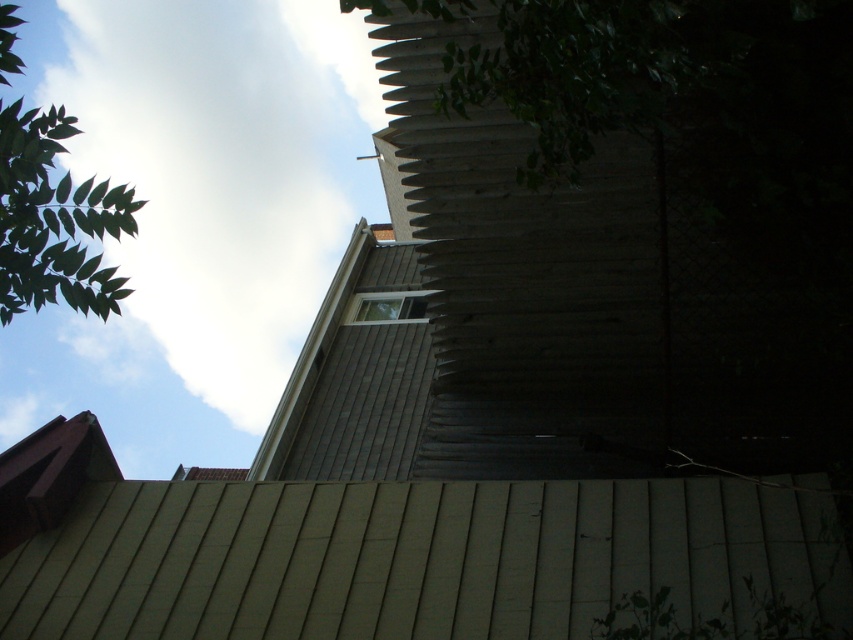
Question: Does green leafy tree at upper left have a greater width compared to clear glass window at upper center?

Choices:
 (A) yes
 (B) no

Answer: (A)

Question: Which object is farther from the camera taking this photo?

Choices:
 (A) green leafy tree at upper left
 (B) clear glass window at upper center

Answer: (B)

Question: Does green leafy tree at upper left appear on the right side of clear glass window at upper center?

Choices:
 (A) no
 (B) yes

Answer: (A)

Question: Which of the following is the farthest from the observer?

Choices:
 (A) green leafy tree at upper left
 (B) clear glass window at upper center

Answer: (B)

Question: Which of the following is the closest to the observer?

Choices:
 (A) (368, 296)
 (B) (74, 298)

Answer: (B)

Question: Can you confirm if green leafy tree at upper left is positioned to the right of clear glass window at upper center?

Choices:
 (A) no
 (B) yes

Answer: (A)